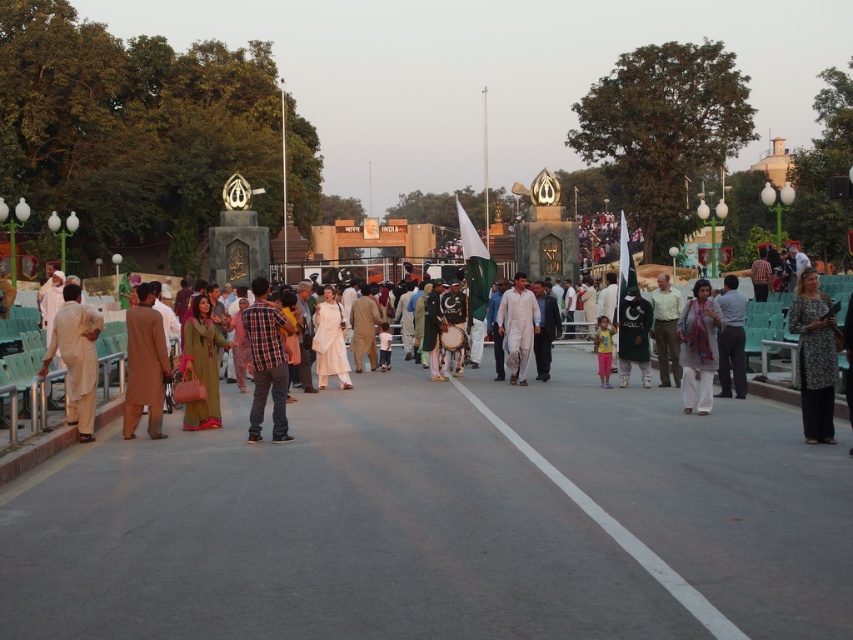
Can you confirm if printed cotton dress at right is thinner than light green fabric shirt at center?

In fact, printed cotton dress at right might be wider than light green fabric shirt at center.

What do you see at coordinates (814, 355) in the screenshot? This screenshot has height=640, width=853. I see `printed cotton dress at right` at bounding box center [814, 355].

The height and width of the screenshot is (640, 853). What do you see at coordinates (814, 355) in the screenshot?
I see `printed cotton dress at right` at bounding box center [814, 355].

The height and width of the screenshot is (640, 853). Identify the location of printed cotton dress at right. (814, 355).

Does printed cotton dress at right appear on the right side of pink fabric dress at center?

Yes, printed cotton dress at right is to the right of pink fabric dress at center.

Who is lower down, printed cotton dress at right or pink fabric dress at center?

pink fabric dress at center

The height and width of the screenshot is (640, 853). I want to click on printed cotton dress at right, so click(x=814, y=355).

Is point (776, 332) positioned behind point (743, 390)?

Yes, point (776, 332) is farther from viewer.

Between light brown fabric dress at center and dark gray shirt at center, which one has more height?

light brown fabric dress at center is taller.

Between point (837, 420) and point (728, 282), which one is positioned behind?

Point (728, 282)

Find the location of a particular element. This screenshot has height=640, width=853. light brown fabric dress at center is located at coordinates (767, 321).